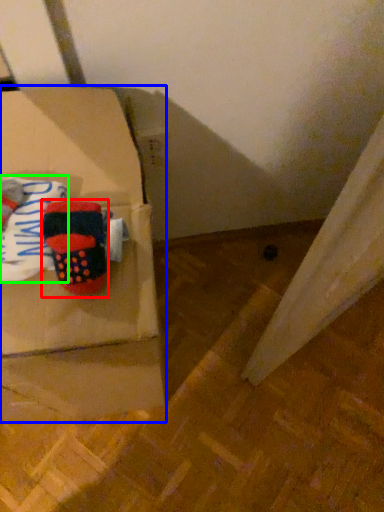
Question: Which object is positioned closest to footwear (highlighted by a red box)? Select from box (highlighted by a blue box) and clothing (highlighted by a green box).

Choices:
 (A) box
 (B) clothing

Answer: (B)